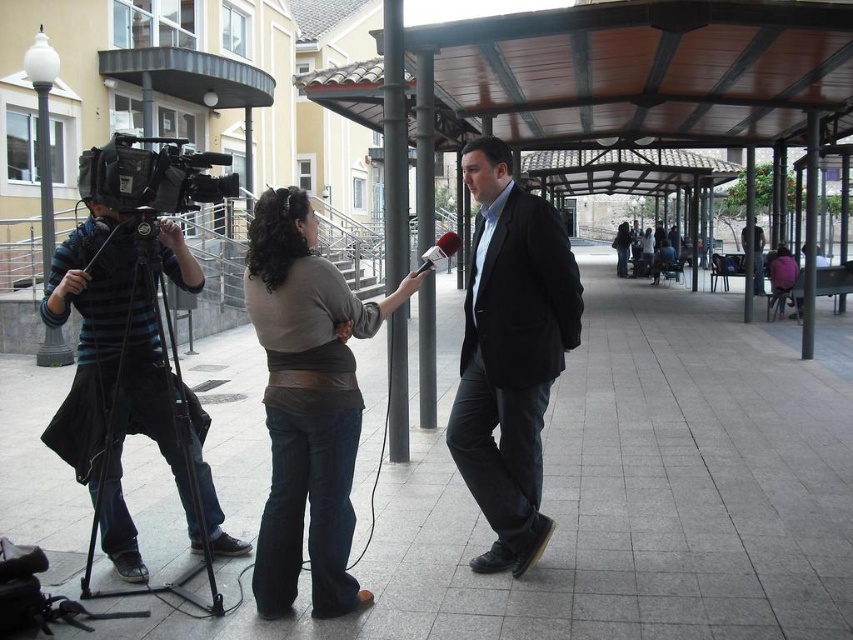
Can you confirm if black matte camera at left is positioned above black matte video camera at left?

No, black matte camera at left is not above black matte video camera at left.

Can you confirm if black matte camera at left is wider than black matte video camera at left?

In fact, black matte camera at left might be narrower than black matte video camera at left.

The height and width of the screenshot is (640, 853). What do you see at coordinates (90, 333) in the screenshot?
I see `black matte camera at left` at bounding box center [90, 333].

Find the location of `black matte camera at left`. black matte camera at left is located at coordinates point(90,333).

Does matte black suit at center have a larger size compared to black matte video camera at left?

Incorrect, matte black suit at center is not larger than black matte video camera at left.

Between point (486, 493) and point (183, 163), which one is positioned behind?

Positioned behind is point (486, 493).

Find the location of a particular element. matte black suit at center is located at coordinates (509, 353).

Can you confirm if brown leather jacket at center is thinner than red fabric microphone at center?

Result: No, brown leather jacket at center is not thinner than red fabric microphone at center.

Measure the distance between point (315, 486) and camera.

Point (315, 486) is 10.46 feet away from camera.

At what (x,y) coordinates should I click in order to perform the action: click on brown leather jacket at center. Please return your answer as a coordinate pair (x, y). Image resolution: width=853 pixels, height=640 pixels. Looking at the image, I should click on (306, 403).